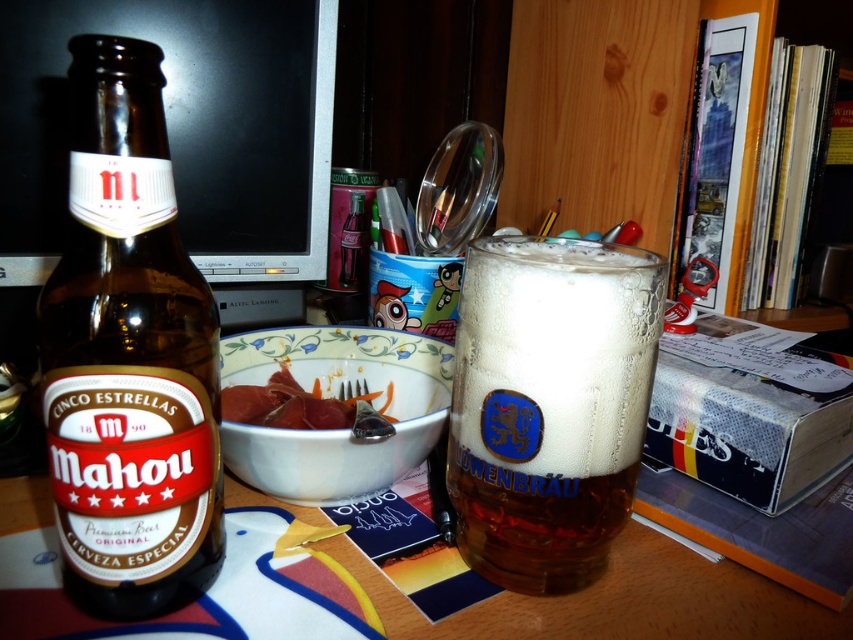
You are a delivery person who needs to place a new bottle on the table between the brown glass bottle at left and the clear glass bottle at center. The new bottle is 12 inches long. Can the bottle fit between them?

The distance between the brown glass bottle at left and the clear glass bottle at center is 26.03 inches. Since the new bottle is 12 inches long, there is enough space to place it between them.

You are organizing items on a desk and need to place a new keyboard. The brown glass bottle at left and the black glossy computer monitor at upper center are already there. Which item should you move to make space for the keyboard?

The brown glass bottle at left is closer to the viewer than the black glossy computer monitor at upper center, so you should move the brown glass bottle at left to make space for the keyboard.

You are a detective examining a crime scene. You have a metallic reflective magnifying glass at upper center and a smooth pinkish meat at center. Which object is closer to you?

The metallic reflective magnifying glass at upper center is closer to you because the smooth pinkish meat at center is behind it.